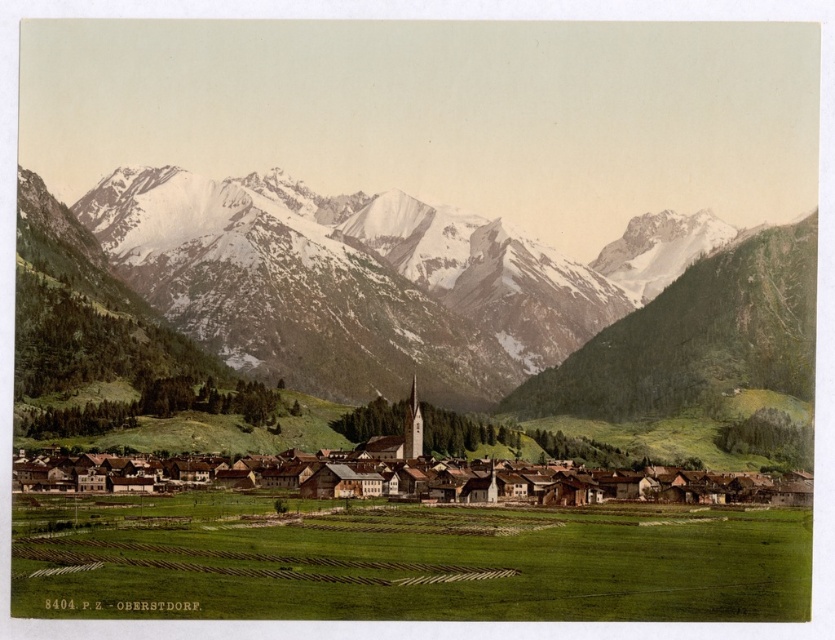
Does snowy granite mountains at upper center appear over brown wooden houses at center?

Yes, snowy granite mountains at upper center is above brown wooden houses at center.

Does snowy granite mountains at upper center have a greater height compared to brown wooden houses at center?

Yes, snowy granite mountains at upper center is taller than brown wooden houses at center.

Where is `snowy granite mountains at upper center`? This screenshot has height=640, width=835. snowy granite mountains at upper center is located at coordinates (446, 291).

Locate an element on the screen. snowy granite mountains at upper center is located at coordinates (446, 291).

Who is more distant from viewer, (431, 467) or (343, 476)?

The point (431, 467) is more distant.

Which is in front, point (464, 496) or point (363, 477)?

Point (363, 477)

This screenshot has height=640, width=835. What do you see at coordinates (345, 456) in the screenshot?
I see `brown wooden houses at center` at bounding box center [345, 456].

Where is `brown wooden houses at center`? Image resolution: width=835 pixels, height=640 pixels. brown wooden houses at center is located at coordinates (345, 456).

Is point (421, 244) positioned behind point (378, 474)?

Yes, it is.

Who is more distant from viewer, (811, 216) or (319, 472)?

Positioned behind is point (811, 216).

The height and width of the screenshot is (640, 835). Find the location of `snowy granite mountains at upper center`. snowy granite mountains at upper center is located at coordinates (446, 291).

The height and width of the screenshot is (640, 835). Identify the location of snowy granite mountains at upper center. (446, 291).